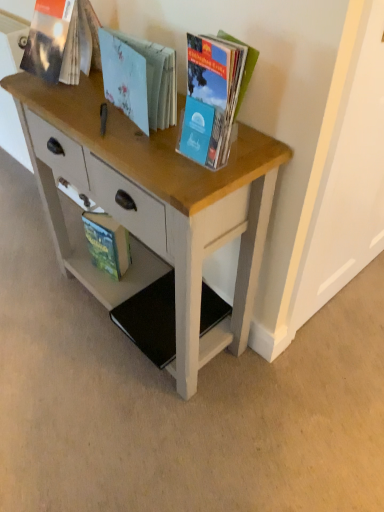
Question: From the image's perspective, is wooden desk at center positioned above or below matte plastic book at upper right, the fourth book from the back?

Choices:
 (A) below
 (B) above

Answer: (A)

Question: From a real-world perspective, is wooden desk at center physically located above or below matte plastic book at upper right, the fourth book from the back?

Choices:
 (A) above
 (B) below

Answer: (B)

Question: Which object is positioned farthest from the matte paper book at upper left, positioned as the second book in back-to-front order?

Choices:
 (A) light blue paper book at center, which ranks as the third book in back-to-front order
 (B) green matte book at lower left, the 4th book in the front-to-back sequence
 (C) wooden desk at center
 (D) matte plastic book at upper right, the first book in the front-to-back sequence

Answer: (B)

Question: Which object is positioned closest to the green matte book at lower left, the 4th book in the front-to-back sequence?

Choices:
 (A) wooden desk at center
 (B) matte plastic book at upper right, the fourth book from the back
 (C) matte paper book at upper left, positioned as the second book in back-to-front order
 (D) light blue paper book at center, the 2th book when ordered from front to back

Answer: (A)